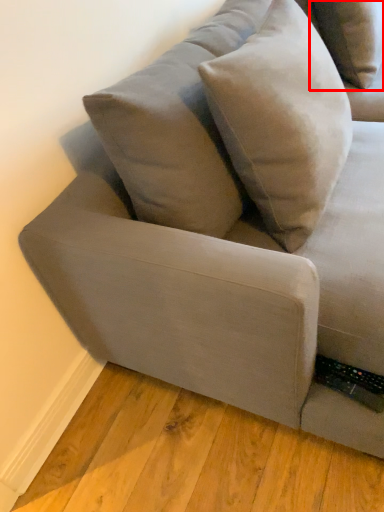
Question: From the image's perspective, what is the correct spatial relationship of pillow (annotated by the red box) in relation to throw pillow?

Choices:
 (A) above
 (B) below

Answer: (A)